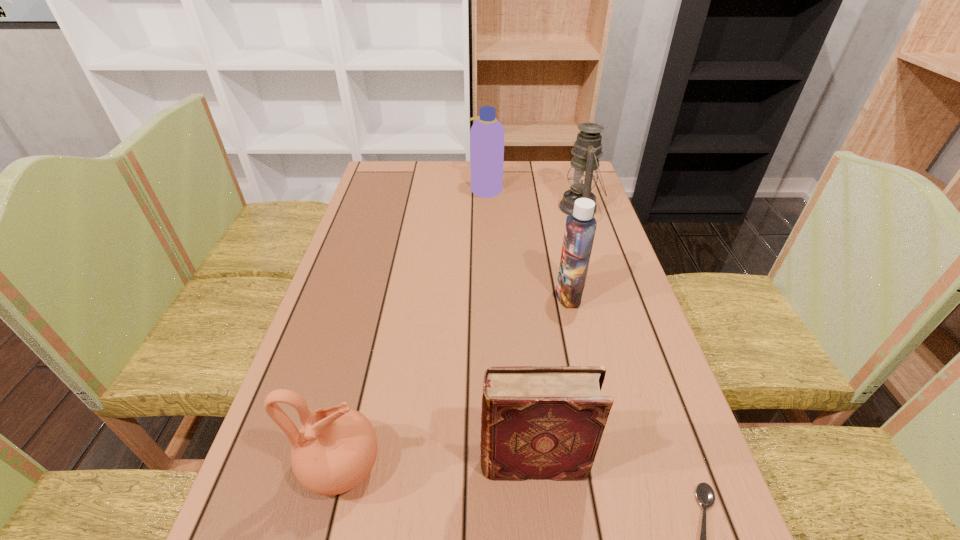
This screenshot has width=960, height=540. In order to click on the left shampoo in this screenshot , I will do `click(487, 134)`.

What are the coordinates of `oil lamp` in the screenshot? It's located at (583, 173).

Where is `the third object from right to left`? This screenshot has width=960, height=540. the third object from right to left is located at coordinates (580, 227).

Image resolution: width=960 pixels, height=540 pixels. Find the location of `the nearer shampoo`. the nearer shampoo is located at coordinates (580, 227).

I want to click on hardback book, so click(537, 422).

Locate an element on the screen. This screenshot has height=540, width=960. the leftmost object is located at coordinates (335, 449).

I want to click on free space located on the left of the farther shampoo, so click(x=370, y=189).

This screenshot has width=960, height=540. What are the coordinates of `free space located on the front of the oil lamp` in the screenshot? It's located at (593, 248).

Locate an element on the screen. free space located on the front label of the right shampoo is located at coordinates (493, 295).

This screenshot has width=960, height=540. I want to click on vacant point located on the front label of the right shampoo, so click(450, 295).